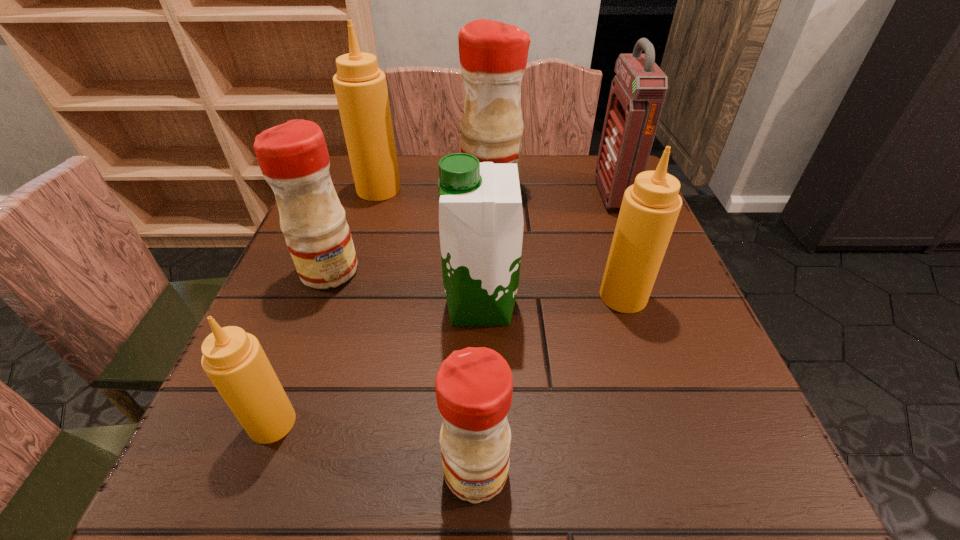
Where is `object that is the second closest to the soya milk`? Image resolution: width=960 pixels, height=540 pixels. object that is the second closest to the soya milk is located at coordinates (293, 157).

I want to click on condiment that can be found as the third closest to the nearest red condiment, so tap(293, 157).

Choose which condiment is the fourth nearest neighbor to the biggest tan condiment. Please provide its 2D coordinates. Your answer should be formatted as a tuple, i.e. [(x, y)], where the tuple contains the x and y coordinates of a point satisfying the conditions above.

[(234, 361)]

Select which tan condiment is the closest to the farthest red condiment. Please provide its 2D coordinates. Your answer should be formatted as a tuple, i.e. [(x, y)], where the tuple contains the x and y coordinates of a point satisfying the conditions above.

[(360, 86)]

Identify which tan condiment is located as the second nearest to the second farthest tan condiment. Please provide its 2D coordinates. Your answer should be formatted as a tuple, i.e. [(x, y)], where the tuple contains the x and y coordinates of a point satisfying the conditions above.

[(234, 361)]

Point out which red condiment is positioned as the second nearest to the smallest tan condiment. Please provide its 2D coordinates. Your answer should be formatted as a tuple, i.e. [(x, y)], where the tuple contains the x and y coordinates of a point satisfying the conditions above.

[(293, 157)]

The height and width of the screenshot is (540, 960). I want to click on red condiment that stands as the closest to the smallest red condiment, so [293, 157].

What are the coordinates of `blank space that satisfies the following two spatial constraints: 1. on the back side of the nearest red condiment; 2. on the right side of the rightmost condiment` in the screenshot? It's located at (477, 296).

This screenshot has width=960, height=540. Find the location of `free space that satisfies the following two spatial constraints: 1. on the front side of the nearest red condiment; 2. on the left side of the leftmost red condiment`. free space that satisfies the following two spatial constraints: 1. on the front side of the nearest red condiment; 2. on the left side of the leftmost red condiment is located at coordinates (254, 471).